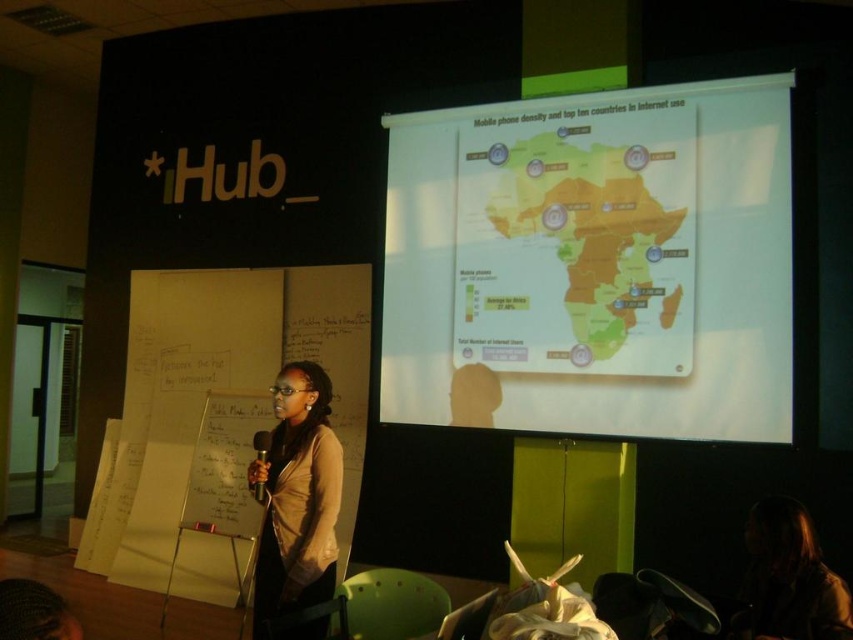
Question: Which of these objects is positioned closest to the matte plastic map at center?

Choices:
 (A) metallic silver microphone at center
 (B) matte beige sweater at center

Answer: (B)

Question: Which point is closer to the camera taking this photo?

Choices:
 (A) (291, 589)
 (B) (267, 449)
 (C) (741, 268)

Answer: (A)

Question: Does matte beige sweater at center have a greater width compared to metallic silver microphone at center?

Choices:
 (A) no
 (B) yes

Answer: (B)

Question: Which point appears farthest from the camera in this image?

Choices:
 (A) (694, 339)
 (B) (265, 444)
 (C) (271, 436)

Answer: (A)

Question: Can you confirm if matte beige sweater at center is bigger than metallic silver microphone at center?

Choices:
 (A) yes
 (B) no

Answer: (A)

Question: Does matte beige sweater at center come behind metallic silver microphone at center?

Choices:
 (A) yes
 (B) no

Answer: (B)